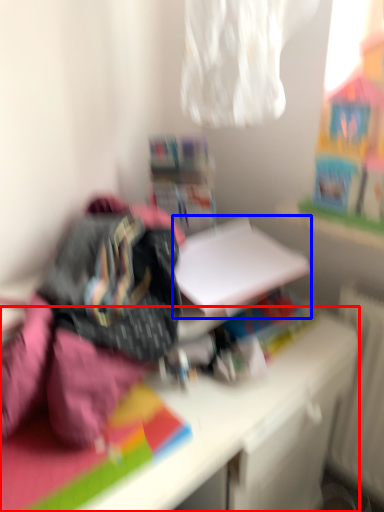
Question: Which point is further to the camera, desk (highlighted by a red box) or paperback book (highlighted by a blue box)?

Choices:
 (A) desk
 (B) paperback book

Answer: (B)